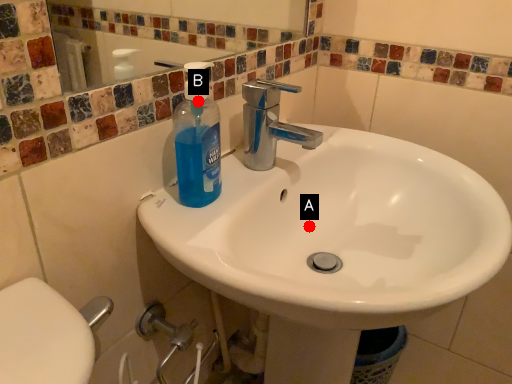
Question: Two points are circled on the image, labeled by A and B beside each circle. Which point appears closest to the camera in this image?

Choices:
 (A) A is closer
 (B) B is closer

Answer: (B)